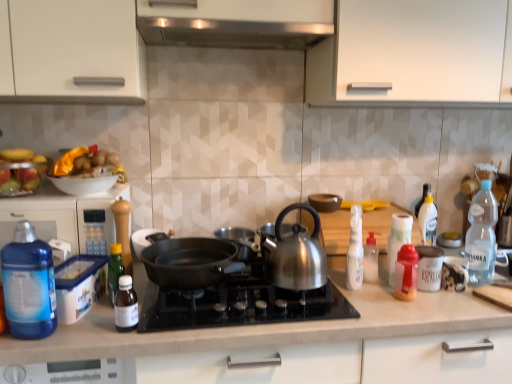
Question: Is transparent plastic bottle at right, the 8th bottle positioned from the left, situated inside white plastic bottle at right, which is the 7th bottle in left-to-right order, or outside?

Choices:
 (A) outside
 (B) inside

Answer: (A)

Question: Based on their sizes in the image, would you say transparent plastic bottle at right, the 8th bottle positioned from the left, is bigger or smaller than white plastic bottle at right, the second bottle from the right?

Choices:
 (A) big
 (B) small

Answer: (A)

Question: Which of these objects is positioned farthest from the shiny metallic kettle at center, which appears as the 3th kitchen appliance when viewed from the right?

Choices:
 (A) translucent plastic bottle at right, the sixth bottle positioned from the left
 (B) white plastic spray bottle at center-right, arranged as the fourth bottle when viewed from the left
 (C) blue translucent bottle at left, the 8th bottle when ordered from right to left
 (D) transparent plastic bottle at right, which is counted as the 1th bottle, starting from the right
 (E) white plastic bottle at right, which ranks as the fourth bottle in right-to-left order

Answer: (D)

Question: Estimate the real-world distances between objects in this image. Which object is farther from the blue plastic container at left?

Choices:
 (A) white plastic spray bottle at center-right, arranged as the fourth bottle when viewed from the left
 (B) brown matte bowl at center, marked as the 3th kitchen appliance in a left-to-right arrangement
 (C) white plastic bottle at right, the second bottle from the right
 (D) green glass bottle at left, the 7th bottle from the right
 (E) blue translucent bottle at left, marked as the 1th bottle in a left-to-right arrangement

Answer: (C)